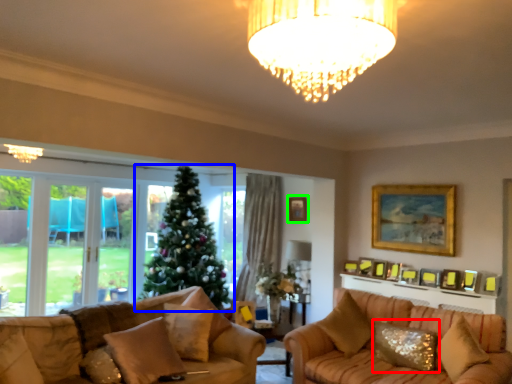
Question: Based on their relative distances, which object is nearer to pillow (highlighted by a red box)? Choose from christmas tree (highlighted by a blue box) and picture frame (highlighted by a green box).

Choices:
 (A) christmas tree
 (B) picture frame

Answer: (B)